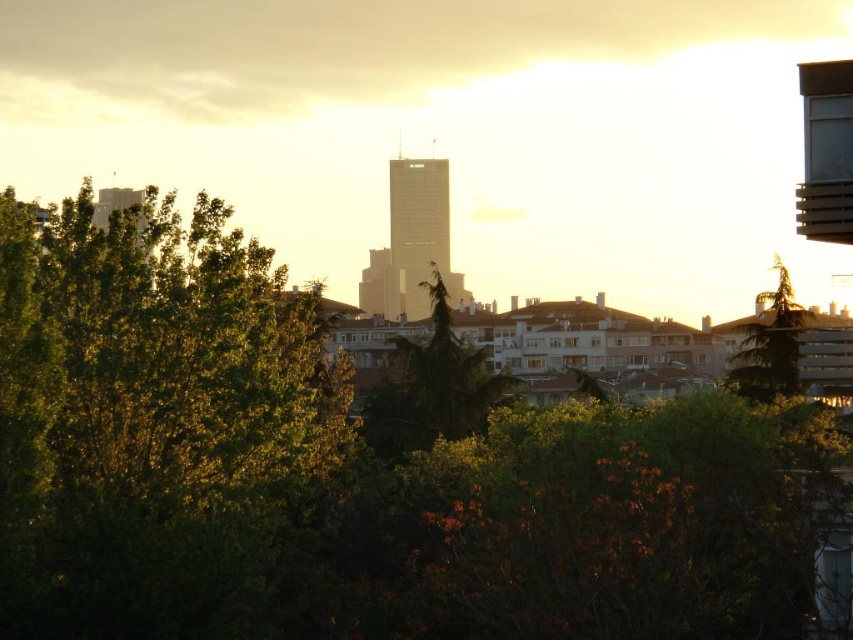
You are standing in the city looking at the skyscraper. There are two points marked on the image. The first point is at coordinates point (830, 442) and the second point is at point (477, 417). Which point is closer to you?

Point (830, 442) is closer to the viewer than point (477, 417).

You are a city planner analyzing the space between two trees in the foreground. The trees are the green leafy tree at center and the green textured tree at center. Which tree has a wider spread of branches and leaves?

The green leafy tree at center has a wider spread of branches and leaves compared to the green textured tree at center because its width is larger than the latter.

You are standing at the base of the green leafy tree at center and want to take a photo of the tall skyscraper in the background. Your camera has a maximum focus range of 200 meters. Will the skyscraper be in focus?

The distance between the green leafy tree at center and the camera is 201.50 meters, which exceeds the camera maximum focus range of 200 meters. Therefore, the skyscraper will not be in focus.